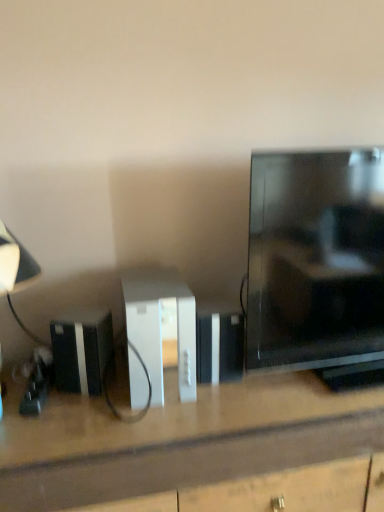
The image size is (384, 512). I want to click on free point in front of white plastic console at center, so click(x=135, y=437).